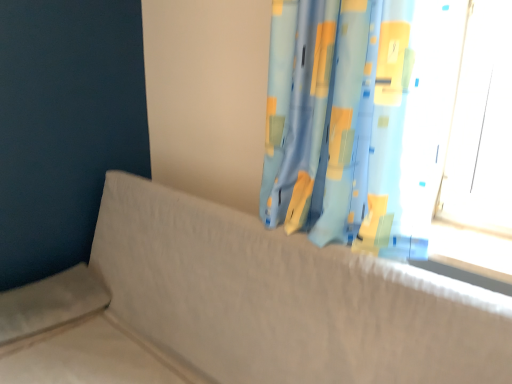
What do you see at coordinates (369, 130) in the screenshot? I see `blue fabric curtain at upper right` at bounding box center [369, 130].

Locate an element on the screen. This screenshot has width=512, height=384. blue fabric curtain at upper right is located at coordinates 369,130.

Find the location of `textured beige couch at center`. textured beige couch at center is located at coordinates (242, 307).

What do you see at coordinates (242, 307) in the screenshot?
I see `textured beige couch at center` at bounding box center [242, 307].

I want to click on blue fabric curtain at upper right, so click(369, 130).

Does blue fabric curtain at upper right appear on the right side of textured beige couch at center?

Correct, you'll find blue fabric curtain at upper right to the right of textured beige couch at center.

Who is more distant, blue fabric curtain at upper right or textured beige couch at center?

blue fabric curtain at upper right is more distant.

Which is less distant, (381, 59) or (127, 220)?

Point (381, 59) is closer to the camera than point (127, 220).

From the image's perspective, is blue fabric curtain at upper right located beneath textured beige couch at center?

No, from the image's perspective, blue fabric curtain at upper right is not below textured beige couch at center.

From a real-world perspective, between blue fabric curtain at upper right and textured beige couch at center, who is vertically lower?

textured beige couch at center is physically lower.

Considering the sizes of blue fabric curtain at upper right and textured beige couch at center in the image, is blue fabric curtain at upper right wider or thinner than textured beige couch at center?

blue fabric curtain at upper right is thinner than textured beige couch at center.

Does blue fabric curtain at upper right have a greater height compared to textured beige couch at center?

Incorrect, the height of blue fabric curtain at upper right is not larger of that of textured beige couch at center.

Who is bigger, blue fabric curtain at upper right or textured beige couch at center?

Bigger between the two is textured beige couch at center.

In the scene shown: Is blue fabric curtain at upper right surrounding textured beige couch at center?

No, blue fabric curtain at upper right does not contain textured beige couch at center.

Is blue fabric curtain at upper right not near textured beige couch at center?

blue fabric curtain at upper right is near textured beige couch at center, not far away.

Is blue fabric curtain at upper right oriented towards textured beige couch at center?

No, blue fabric curtain at upper right is not facing towards textured beige couch at center.

Find the location of a particular element. The image size is (512, 384). couch in front of the blue fabric curtain at upper right is located at coordinates point(242,307).

Is textured beige couch at center to the left or to the right of blue fabric curtain at upper right in the image?

In the image, textured beige couch at center appears on the left side of blue fabric curtain at upper right.

Which object is more forward, textured beige couch at center or blue fabric curtain at upper right?

textured beige couch at center.

Does point (249, 301) appear closer or farther from the camera than point (305, 65)?

Clearly, point (249, 301) is more distant from the camera than point (305, 65).

From the image's perspective, is textured beige couch at center below blue fabric curtain at upper right?

Yes.

From a real-world perspective, is textured beige couch at center positioned under blue fabric curtain at upper right based on gravity?

Yes, from a real-world perspective, textured beige couch at center is under blue fabric curtain at upper right.

Is textured beige couch at center thinner than blue fabric curtain at upper right?

In fact, textured beige couch at center might be wider than blue fabric curtain at upper right.

From the picture: Is textured beige couch at center taller than blue fabric curtain at upper right?

Yes, textured beige couch at center is taller than blue fabric curtain at upper right.

Considering the sizes of textured beige couch at center and blue fabric curtain at upper right in the image, is textured beige couch at center bigger or smaller than blue fabric curtain at upper right?

Clearly, textured beige couch at center is larger in size than blue fabric curtain at upper right.

Is textured beige couch at center inside the boundaries of blue fabric curtain at upper right, or outside?

textured beige couch at center exists outside the volume of blue fabric curtain at upper right.

Is textured beige couch at center far from blue fabric curtain at upper right?

No, textured beige couch at center is not far from blue fabric curtain at upper right.

Could you tell me if textured beige couch at center is facing blue fabric curtain at upper right?

No, textured beige couch at center is not turned towards blue fabric curtain at upper right.

How much distance is there between textured beige couch at center and blue fabric curtain at upper right?

textured beige couch at center and blue fabric curtain at upper right are 17.30 inches apart from each other.

Locate an element on the screen. curtain lying on the right of textured beige couch at center is located at coordinates (369, 130).

Identify the location of couch below the blue fabric curtain at upper right (from the image's perspective). The width and height of the screenshot is (512, 384). (242, 307).

At what (x,y) coordinates should I click in order to perform the action: click on couch beneath the blue fabric curtain at upper right (from a real-world perspective). Please return your answer as a coordinate pair (x, y). Looking at the image, I should click on (242, 307).